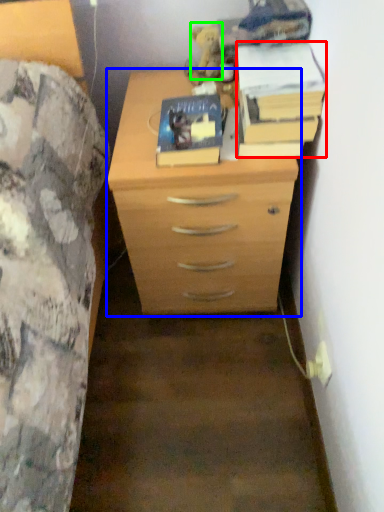
Question: Which object is the farthest from paperback book (highlighted by a red box)? Choose among these: chest of drawers (highlighted by a blue box) or toy (highlighted by a green box).

Choices:
 (A) chest of drawers
 (B) toy

Answer: (B)